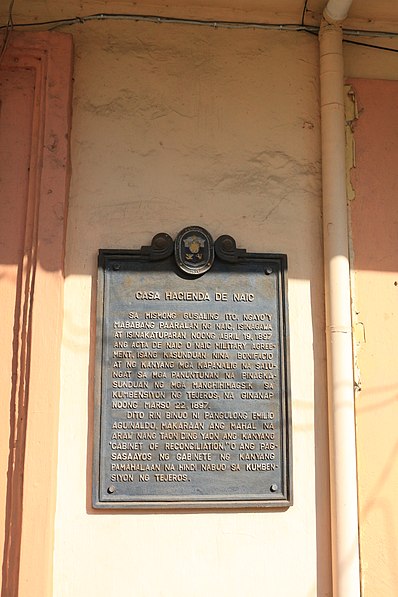
Identify the location of wood frame. (23, 61), (40, 138).